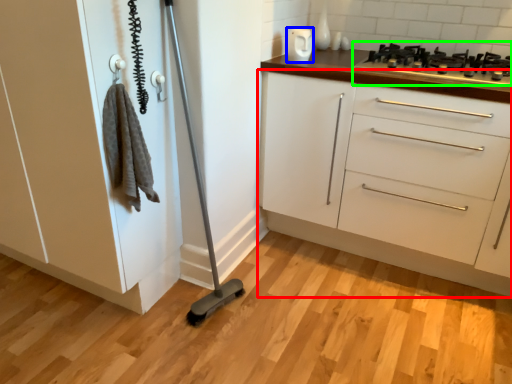
Question: Which object is positioned closest to chest of drawers (highlighted by a red box)? Select from appliance (highlighted by a blue box) and gas stove (highlighted by a green box).

Choices:
 (A) appliance
 (B) gas stove

Answer: (B)